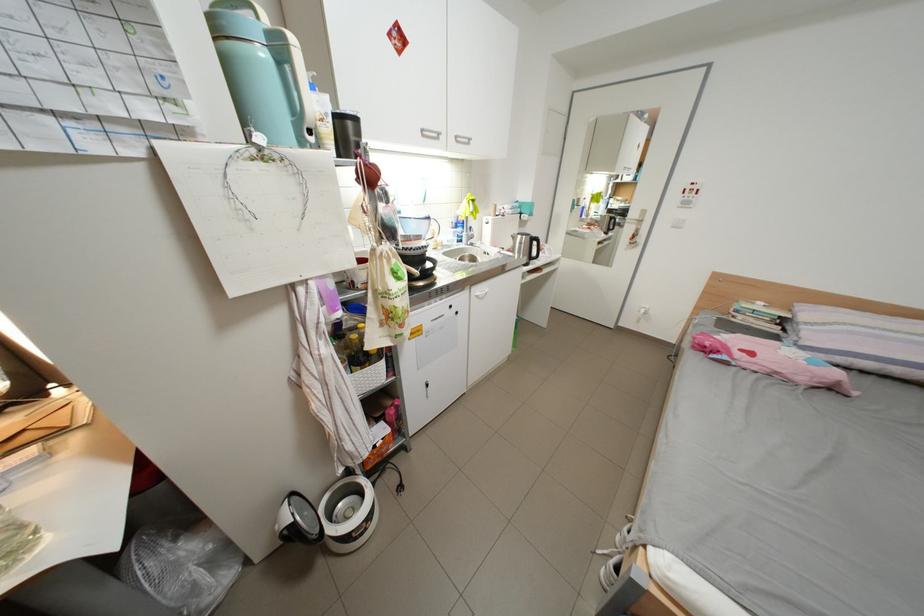
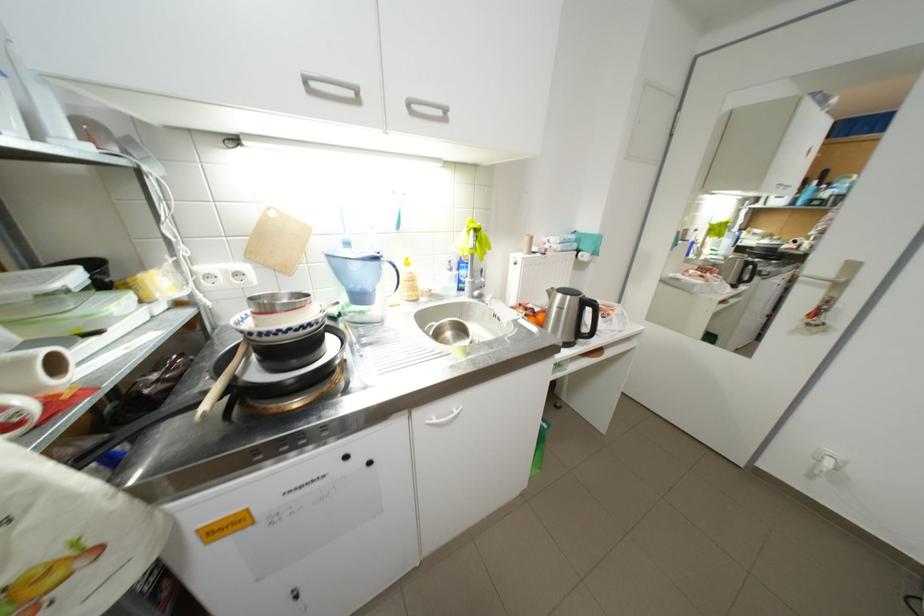
Where in the second image is the point corresponding to [440,219] from the first image?

(387, 259)